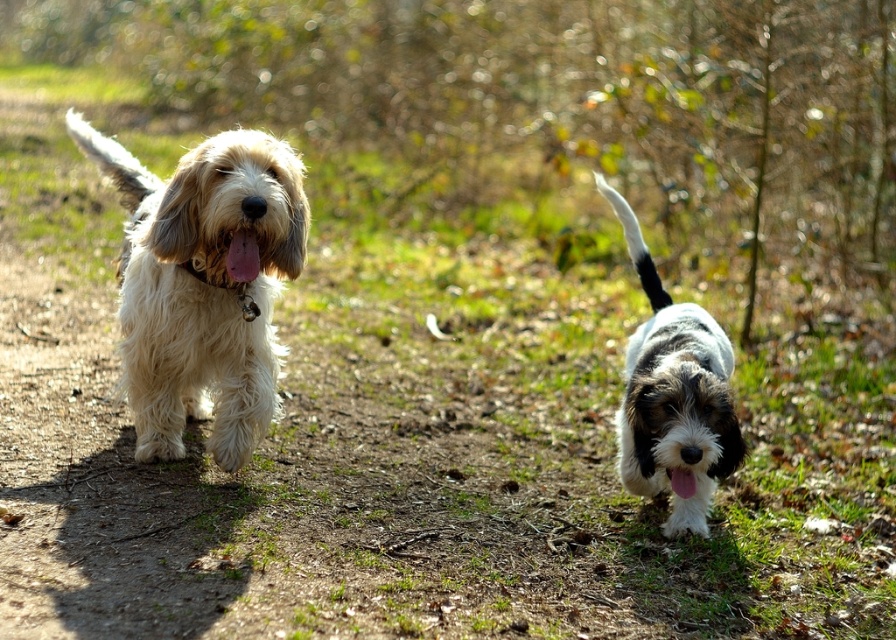
You are a photographer trying to capture both the white fur dog at right and the white fluffy tail at left in a single frame. Since you want to ensure both are visible, which one should you focus on first to account for their sizes?

The white fur dog at right is taller than the white fluffy tail at left, so you should focus on the white fur dog at right first to ensure its details are captured clearly before adjusting for the smaller white fluffy tail at left.

From the picture: You are a photographer trying to capture both the fluffy white dog at center and the black and white fur tail at right in a single shot. Based on their positions, can you tell which one is closer to the camera?

The fluffy white dog at center is located below the black and white fur tail at right, which means the black and white fur tail at right is closer to the camera.

You are standing on the dirt path and see two points marked in the image. The first point is at coordinates point (116,148) and the second is at point (627,211). Which point is closer to you?

Point (116,148) is closer to you because it is further to the viewer than point (627,211).